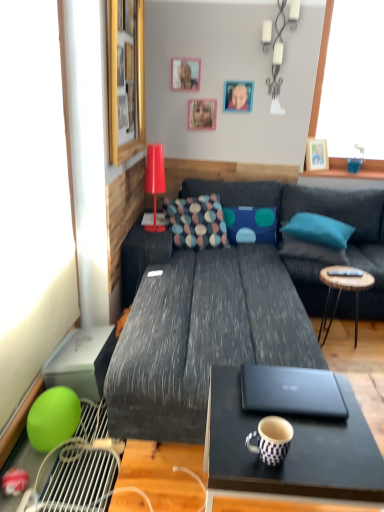
The image size is (384, 512). Identify the location of vacant point above matte black coffee table at lower right (from a real-world perspective). (294, 417).